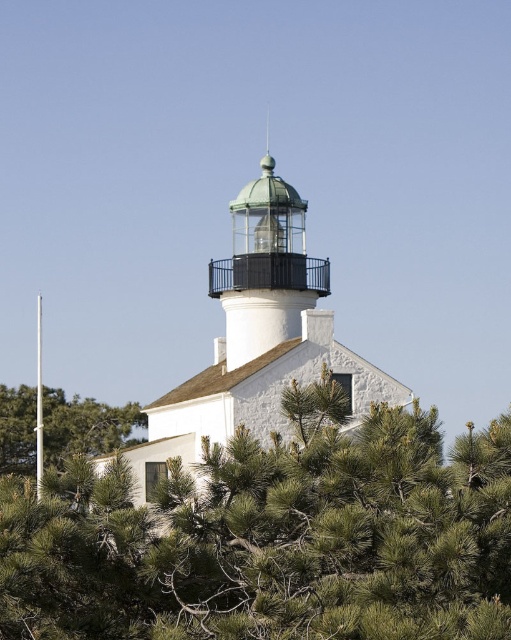
Does green needle-like at center appear on the right side of green needle-like tree at left?

Correct, you'll find green needle-like at center to the right of green needle-like tree at left.

Between green needle-like at center and green needle-like tree at left, which one is positioned lower?

green needle-like tree at left is below.

This screenshot has height=640, width=511. Find the location of `green needle-like at center`. green needle-like at center is located at coordinates (273, 538).

Image resolution: width=511 pixels, height=640 pixels. Find the location of `green needle-like at center`. green needle-like at center is located at coordinates (273, 538).

Between green needle-like at center and metallic glass dome at center, which one has less height?

Standing shorter between the two is green needle-like at center.

Where is `green needle-like at center`? The image size is (511, 640). green needle-like at center is located at coordinates (273, 538).

Does point (327, 388) lie behind point (267, 257)?

No, (327, 388) is closer to viewer.

Where is `green needle-like at center`? The image size is (511, 640). green needle-like at center is located at coordinates (273, 538).

Is metallic glass dome at center positioned behind green needle-like tree at left?

No, metallic glass dome at center is in front of green needle-like tree at left.

How distant is metallic glass dome at center from green needle-like tree at left?

metallic glass dome at center and green needle-like tree at left are 26.66 meters apart.

Image resolution: width=511 pixels, height=640 pixels. What are the coordinates of `metallic glass dome at center` in the screenshot? It's located at (266, 268).

Find the location of `metallic glass dome at center`. metallic glass dome at center is located at coordinates (266, 268).